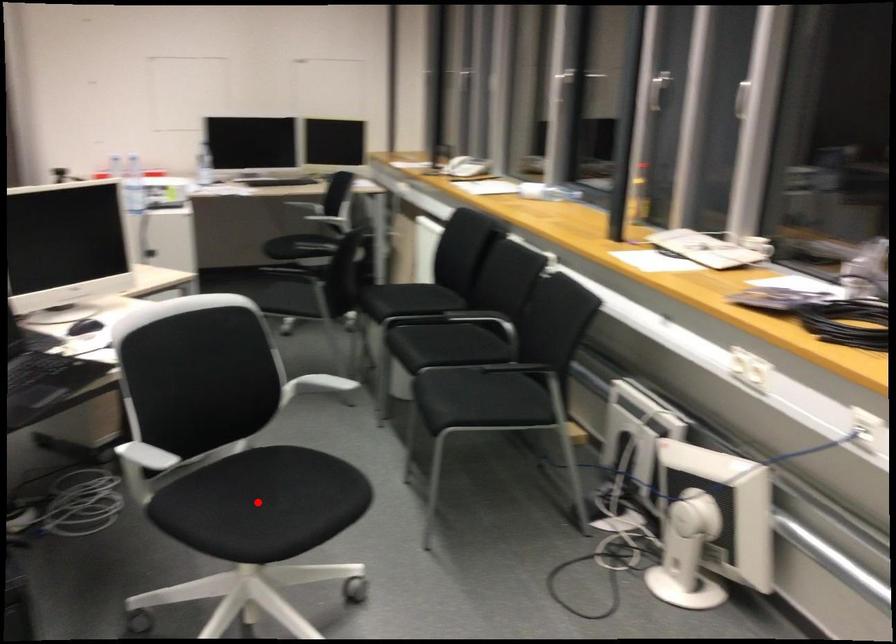
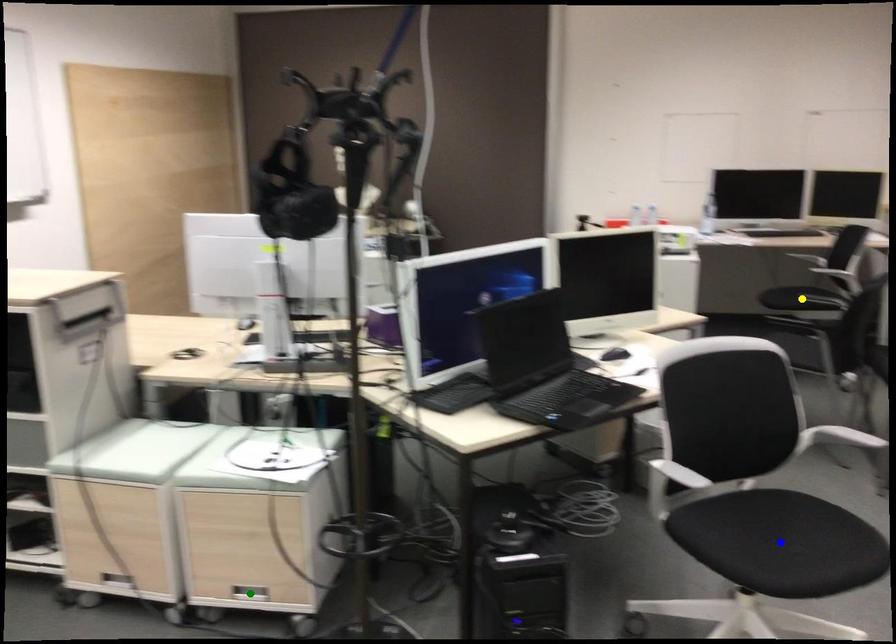
Question: I am providing you with two images of the same scene from different viewpoints. A red point is marked on the first image. You are given multiple points on the second image. Can you choose the point in image 2 that corresponds to the point in image 1?

Choices:
 (A) yellow point
 (B) green point
 (C) blue point

Answer: (C)